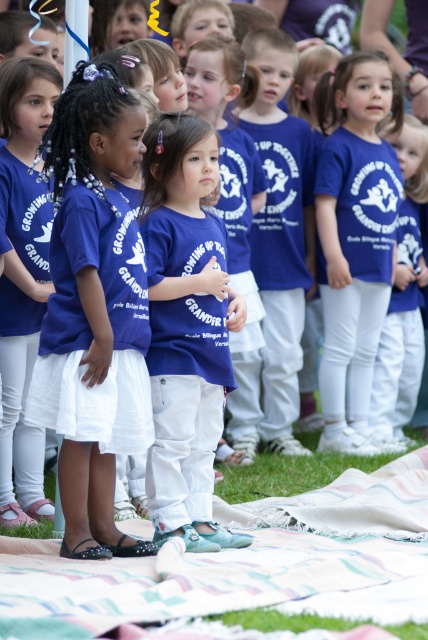
Question: Which object is farther from the camera taking this photo?

Choices:
 (A) patterned fabric blanket at lower center
 (B) matte blue t-shirt at center

Answer: (B)

Question: Considering the relative positions of patterned fabric blanket at lower center and matte blue t-shirt at center in the image provided, where is patterned fabric blanket at lower center located with respect to matte blue t-shirt at center?

Choices:
 (A) left
 (B) right

Answer: (B)

Question: Is patterned fabric blanket at lower center thinner than matte blue t-shirt at center?

Choices:
 (A) no
 (B) yes

Answer: (A)

Question: Which point is farther from the camera taking this photo?

Choices:
 (A) (228, 388)
 (B) (320, 515)

Answer: (B)

Question: Can you confirm if patterned fabric blanket at lower center is smaller than matte blue t-shirt at center?

Choices:
 (A) no
 (B) yes

Answer: (A)